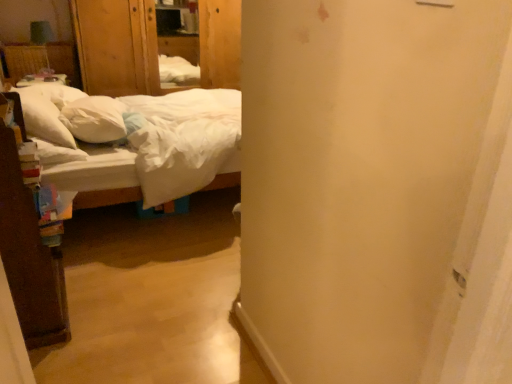
Question: Is white soft pillow at left, the 1th pillow when ordered from left to right, in front of or behind white cotton bed at left in the image?

Choices:
 (A) behind
 (B) front

Answer: (A)

Question: From the image's perspective, relative to white cotton bed at left, is white soft pillow at left, the 1th pillow when ordered from left to right, above or below?

Choices:
 (A) below
 (B) above

Answer: (B)

Question: Which of these objects is positioned closest to the white soft pillow at left, the 1th pillow when ordered from left to right?

Choices:
 (A) white soft pillow at left, which appears as the 1th pillow when viewed from the right
 (B) wooden armoire at upper left
 (C) white cotton bed at left

Answer: (C)

Question: Which object is positioned closest to the white soft pillow at left, the 2th pillow in the left-to-right sequence?

Choices:
 (A) wooden armoire at upper left
 (B) white cotton bed at left
 (C) white soft pillow at left, the 1th pillow when ordered from left to right

Answer: (C)